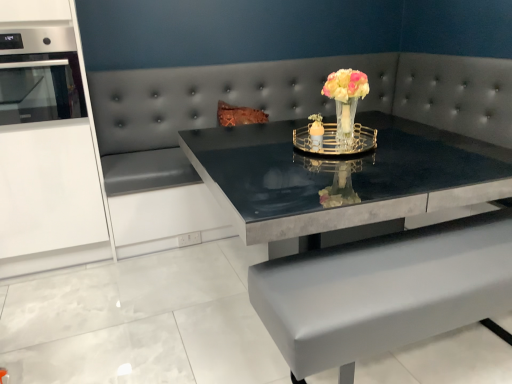
What do you see at coordinates (40, 75) in the screenshot?
I see `stainless steel oven at left` at bounding box center [40, 75].

This screenshot has width=512, height=384. What are the coordinates of `shiny black table at center` in the screenshot? It's located at (383, 291).

Where is `stainless steel oven at left`? stainless steel oven at left is located at coordinates (40, 75).

Is shiny black table at center directly adjacent to translucent glass vase at center?

shiny black table at center and translucent glass vase at center are clearly separated.

This screenshot has width=512, height=384. There is a shiny black table at center. Find the location of `floral arrangement above it (from a real-world perspective)`. floral arrangement above it (from a real-world perspective) is located at coordinates (346, 100).

Considering the sizes of shiny black table at center and translucent glass vase at center in the image, is shiny black table at center taller or shorter than translucent glass vase at center?

Clearly, shiny black table at center is taller compared to translucent glass vase at center.

Which object is wider, shiny black table at center or translucent glass vase at center?

Wider between the two is shiny black table at center.

Does stainless steel oven at left lie in front of translucent glass vase at center?

No, stainless steel oven at left is further to the viewer.

From the image's perspective, would you say stainless steel oven at left is positioned over translucent glass vase at center?

Indeed, from the image's perspective, stainless steel oven at left is shown above translucent glass vase at center.

Is stainless steel oven at left wider than translucent glass vase at center?

Correct, the width of stainless steel oven at left exceeds that of translucent glass vase at center.

Is stainless steel oven at left positioned far away from translucent glass vase at center?

Yes, stainless steel oven at left and translucent glass vase at center are located far from each other.

Can we say translucent glass vase at center lies outside stainless steel oven at left?

A: translucent glass vase at center is positioned outside stainless steel oven at left.

The width and height of the screenshot is (512, 384). I want to click on appliance that is behind the translucent glass vase at center, so click(x=40, y=75).

Consider the image. Which of these two, translucent glass vase at center or stainless steel oven at left, stands taller?

Standing taller between the two is stainless steel oven at left.

Can you confirm if translucent glass vase at center is bigger than stainless steel oven at left?

Incorrect, translucent glass vase at center is not larger than stainless steel oven at left.

Find the location of a particular element. The width and height of the screenshot is (512, 384). table in front of the stainless steel oven at left is located at coordinates (383, 291).

Considering the sizes of objects stainless steel oven at left and shiny black table at center in the image provided, who is thinner, stainless steel oven at left or shiny black table at center?

With smaller width is stainless steel oven at left.

Can you tell me how much stainless steel oven at left and shiny black table at center differ in facing direction?

stainless steel oven at left and shiny black table at center are facing 0.804 degrees away from each other.

Does stainless steel oven at left have a lesser height compared to shiny black table at center?

Yes, stainless steel oven at left is shorter than shiny black table at center.

From the image's perspective, is shiny black table at center above or below stainless steel oven at left?

Clearly, from the image's perspective, shiny black table at center is below stainless steel oven at left.

You are a GUI agent. You are given a task and a screenshot of the screen. Output one action in this format:
    pyautogui.click(x=<x>, y=<y>)
    Task: Click on the table in front of the stainless steel oven at left
    
    Given the screenshot: What is the action you would take?
    pyautogui.click(x=383, y=291)

Does shiny black table at center contain stainless steel oven at left?

No, stainless steel oven at left is not a part of shiny black table at center.

Between shiny black table at center and stainless steel oven at left, which one has smaller width?

stainless steel oven at left is thinner.

Is translucent glass vase at center at the right side of shiny black table at center?

Incorrect, translucent glass vase at center is not on the right side of shiny black table at center.

From a real-world perspective, is translucent glass vase at center physically above shiny black table at center?

Yes.

Is translucent glass vase at center oriented away from shiny black table at center?

translucent glass vase at center does not have its back to shiny black table at center.

At what (x,y) coordinates should I click in order to perform the action: click on floral arrangement behind the shiny black table at center. Please return your answer as a coordinate pair (x, y). The height and width of the screenshot is (384, 512). Looking at the image, I should click on (346, 100).

At what (x,y) coordinates should I click in order to perform the action: click on floral arrangement on the left of shiny black table at center. Please return your answer as a coordinate pair (x, y). The height and width of the screenshot is (384, 512). Looking at the image, I should click on (346, 100).

Identify the location of floral arrangement in front of the stainless steel oven at left. Image resolution: width=512 pixels, height=384 pixels. (346, 100).

From the image, which object appears to be nearer to translucent glass vase at center, stainless steel oven at left or shiny black table at center?

Among the two, shiny black table at center is located nearer to translucent glass vase at center.

Based on their spatial positions, is shiny black table at center or translucent glass vase at center further from stainless steel oven at left?

translucent glass vase at center lies further to stainless steel oven at left than the other object.

Considering their positions, is shiny black table at center positioned further to translucent glass vase at center than stainless steel oven at left?

Based on the image, stainless steel oven at left appears to be further to translucent glass vase at center.

Based on the photo, based on their spatial positions, is stainless steel oven at left or translucent glass vase at center further from shiny black table at center?

stainless steel oven at left is positioned further to the anchor shiny black table at center.

Looking at the image, which one is located closer to stainless steel oven at left, translucent glass vase at center or shiny black table at center?

shiny black table at center is closer to stainless steel oven at left.

Considering their positions, is translucent glass vase at center positioned closer to shiny black table at center than stainless steel oven at left?

translucent glass vase at center.

Image resolution: width=512 pixels, height=384 pixels. What are the coordinates of `floral arrangement situated between stainless steel oven at left and shiny black table at center from left to right` in the screenshot? It's located at (346, 100).